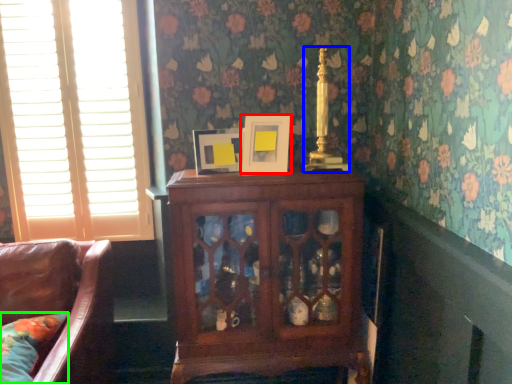
Question: Considering the real-world distances, which object is farthest from picture frame (highlighted by a red box)? candle holder (highlighted by a blue box) or pillow (highlighted by a green box)?

Choices:
 (A) candle holder
 (B) pillow

Answer: (B)